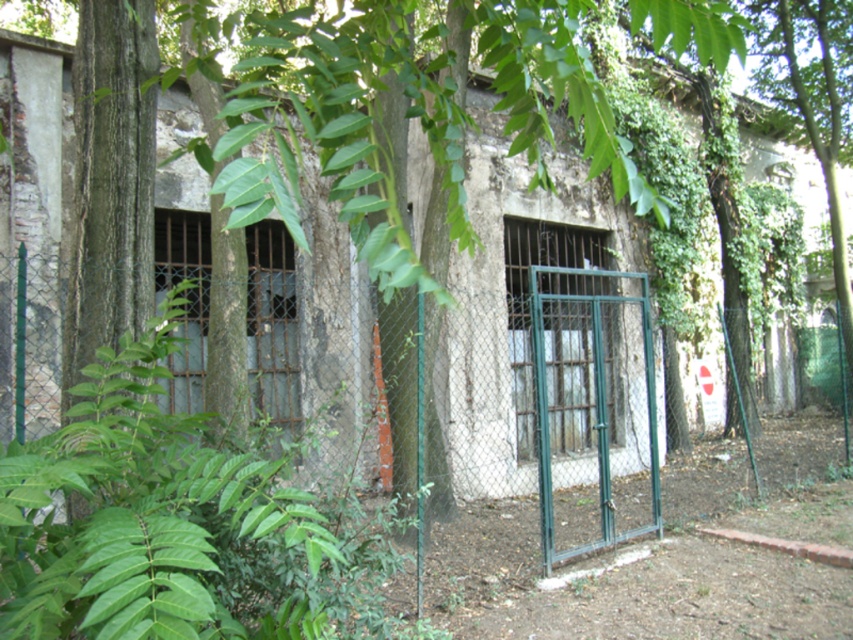
Is green leafy plant at center positioned behind green metal gate at center?

No, green leafy plant at center is in front of green metal gate at center.

Does green leafy plant at center appear on the left side of green metal gate at center?

Yes, green leafy plant at center is to the left of green metal gate at center.

Image resolution: width=853 pixels, height=640 pixels. I want to click on green leafy plant at center, so click(x=163, y=522).

Where is `green leafy plant at center`? The width and height of the screenshot is (853, 640). green leafy plant at center is located at coordinates (163, 522).